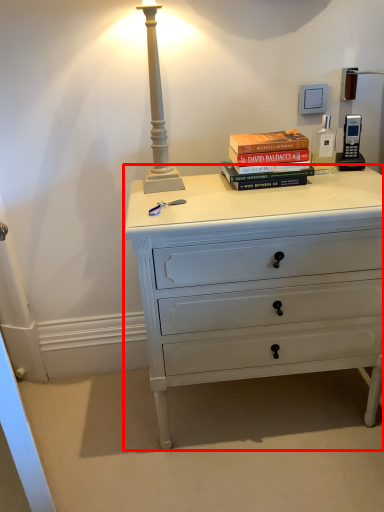
Question: From the image's perspective, what is the correct spatial relationship of chest of drawers (annotated by the red box) in relation to book?

Choices:
 (A) above
 (B) below

Answer: (B)